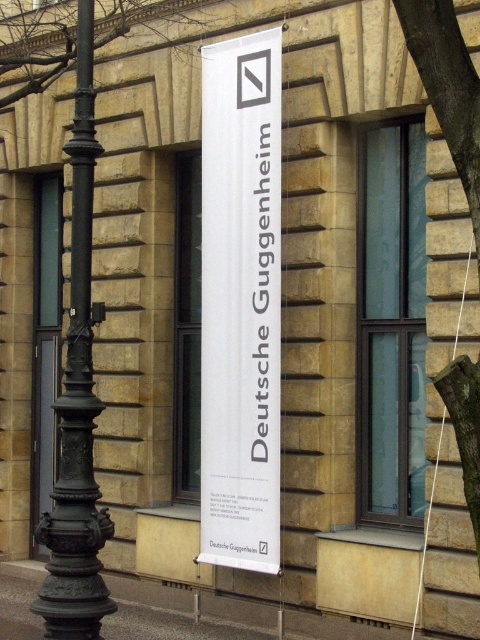
Question: Can you confirm if white paper banner at center is thinner than black cast iron pole at left?

Choices:
 (A) no
 (B) yes

Answer: (A)

Question: Considering the relative positions of white paper banner at center and black cast iron pole at left in the image provided, where is white paper banner at center located with respect to black cast iron pole at left?

Choices:
 (A) above
 (B) below

Answer: (A)

Question: Which point is farther to the camera?

Choices:
 (A) (83, 241)
 (B) (275, 572)

Answer: (B)

Question: Is white paper banner at center smaller than black cast iron pole at left?

Choices:
 (A) yes
 (B) no

Answer: (B)

Question: Among these points, which one is farthest from the camera?

Choices:
 (A) (216, 195)
 (B) (84, 477)

Answer: (A)